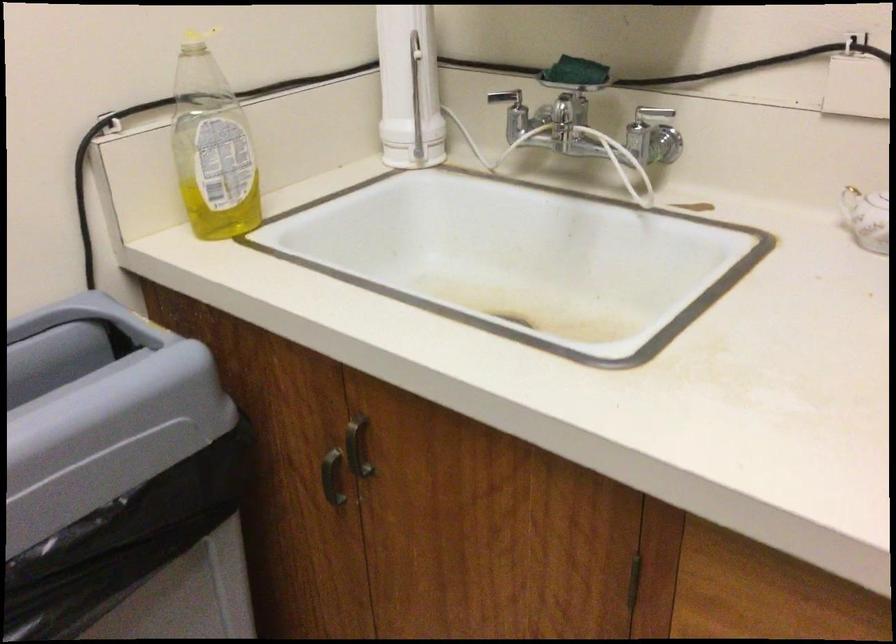
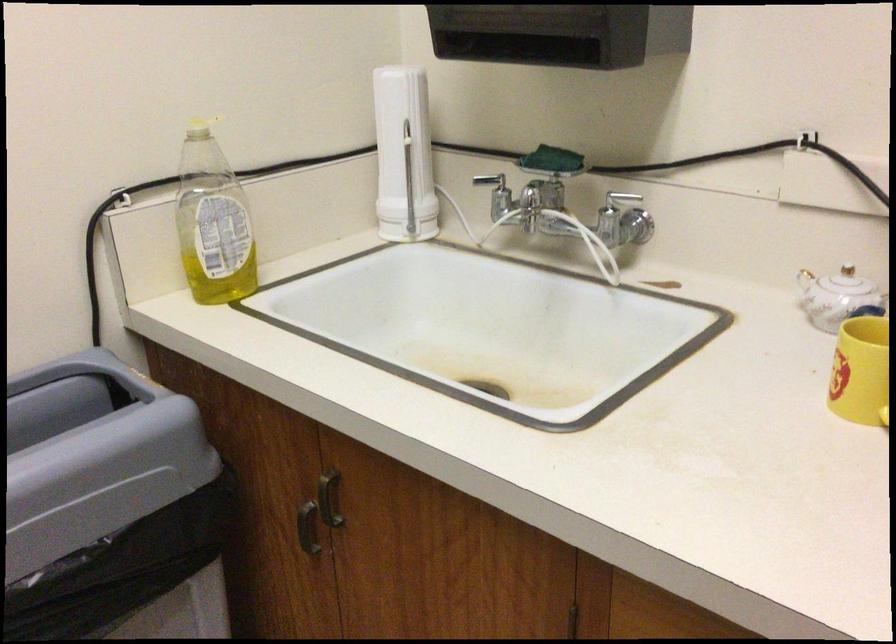
Locate, in the second image, the point that corresponds to (x=634, y=561) in the first image.

(576, 623)